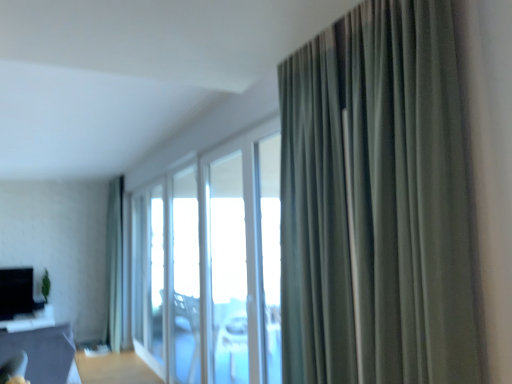
Question: Is white glass screen door at center shorter than transparent glass window at center, the 2th window positioned from the front?

Choices:
 (A) yes
 (B) no

Answer: (B)

Question: Is white glass screen door at center closer to the viewer compared to transparent glass window at center, the 2th window positioned from the front?

Choices:
 (A) no
 (B) yes

Answer: (A)

Question: Is white glass screen door at center wider than transparent glass window at center, arranged as the 2th window when viewed from the back?

Choices:
 (A) no
 (B) yes

Answer: (B)

Question: Is transparent glass window at center, arranged as the 2th window when viewed from the back, surrounded by white glass screen door at center?

Choices:
 (A) yes
 (B) no

Answer: (B)

Question: From the image's perspective, does white glass screen door at center appear lower than transparent glass window at center, arranged as the 2th window when viewed from the back?

Choices:
 (A) yes
 (B) no

Answer: (A)

Question: From the image's perspective, is transparent glass window at center, arranged as the 2th window when viewed from the back, above or below transparent glass window at center, the 3th window when ordered from front to back?

Choices:
 (A) below
 (B) above

Answer: (B)

Question: Do you think transparent glass window at center, arranged as the 2th window when viewed from the back, is within transparent glass window at center, the 3th window when ordered from front to back, or outside of it?

Choices:
 (A) inside
 (B) outside

Answer: (B)

Question: From a real-world perspective, is transparent glass window at center, the 2th window positioned from the front, physically located above or below transparent glass window at center, which is counted as the 1th window, starting from the back?

Choices:
 (A) above
 (B) below

Answer: (A)

Question: Considering the positions of point (234, 173) and point (188, 357), is point (234, 173) closer or farther from the camera than point (188, 357)?

Choices:
 (A) farther
 (B) closer

Answer: (B)

Question: From the image's perspective, relative to green fabric curtain at right, positioned as the 2th curtain in back-to-front order, is transparent glass window at center, arranged as the 2th window when viewed from the back, above or below?

Choices:
 (A) below
 (B) above

Answer: (A)

Question: Would you say transparent glass window at center, arranged as the 2th window when viewed from the back, is to the left or to the right of green fabric curtain at right, positioned as the 2th curtain in back-to-front order, in the picture?

Choices:
 (A) right
 (B) left

Answer: (B)

Question: Looking at the image, does transparent glass window at center, the 2th window positioned from the front, seem bigger or smaller compared to green fabric curtain at right, positioned as the 2th curtain in back-to-front order?

Choices:
 (A) small
 (B) big

Answer: (A)

Question: Is transparent glass window at center, arranged as the 2th window when viewed from the back, taller or shorter than green fabric curtain at right, the first curtain viewed from the right?

Choices:
 (A) short
 (B) tall

Answer: (B)

Question: Is transparent glass window at center, arranged as the 2th window when viewed from the back, taller or shorter than transparent glass window screen at center?

Choices:
 (A) short
 (B) tall

Answer: (A)

Question: From a real-world perspective, is transparent glass window at center, the 2th window positioned from the front, physically located above or below transparent glass window screen at center?

Choices:
 (A) below
 (B) above

Answer: (B)